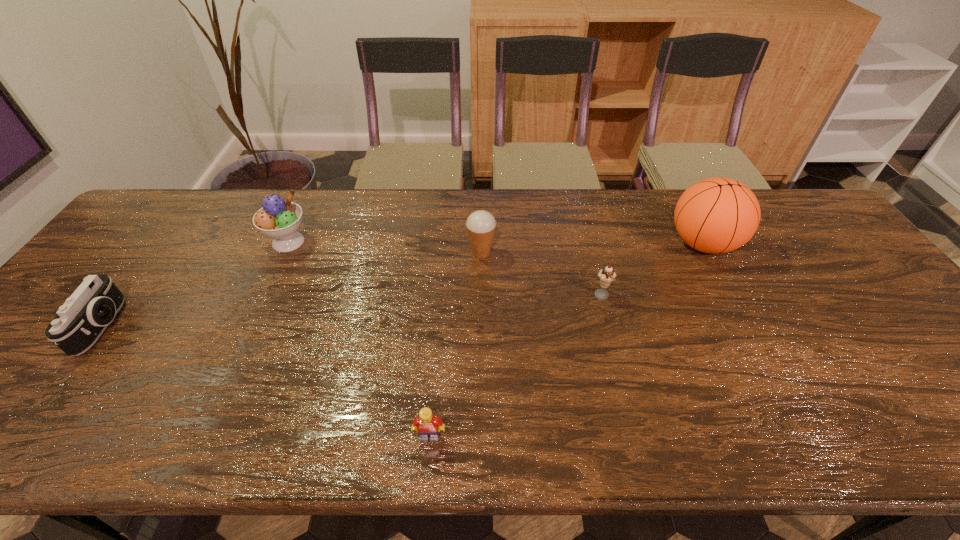
Locate an element on the screen. Image resolution: width=960 pixels, height=540 pixels. vacant area situated 0.290m on the right of the fifth object from right to left is located at coordinates (408, 242).

Where is `free region located on the right of the fourth object from left to right`? free region located on the right of the fourth object from left to right is located at coordinates (588, 252).

At what (x,y) coordinates should I click in order to perform the action: click on free space located on the front of the rightmost icecream. Please return your answer as a coordinate pair (x, y). The width and height of the screenshot is (960, 540). Looking at the image, I should click on (637, 436).

Identify the location of vacant space situated 0.250m on the front lens of the leftmost object. (221, 326).

Locate an element on the screen. The image size is (960, 540). basketball at the far edge is located at coordinates (716, 215).

At what (x,y) coordinates should I click in order to perform the action: click on icecream positioned at the far edge. Please return your answer as a coordinate pair (x, y). Looking at the image, I should click on (278, 218).

Locate an element on the screen. The width and height of the screenshot is (960, 540). object that is at the near edge is located at coordinates (427, 425).

The width and height of the screenshot is (960, 540). Find the location of `object that is at the left edge`. object that is at the left edge is located at coordinates (80, 321).

What are the coordinates of `free space at the far edge of the desktop` in the screenshot? It's located at (524, 225).

In the image, there is a desktop. Where is `free region at the near edge`? The height and width of the screenshot is (540, 960). free region at the near edge is located at coordinates (251, 429).